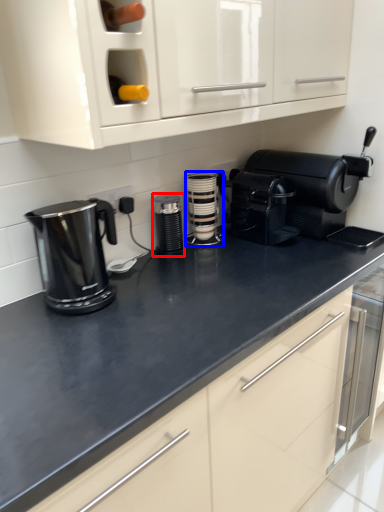
Question: Which object appears closest to the camera in this image, kitchen appliance (highlighted by a red box) or kitchen appliance (highlighted by a blue box)?

Choices:
 (A) kitchen appliance
 (B) kitchen appliance

Answer: (A)